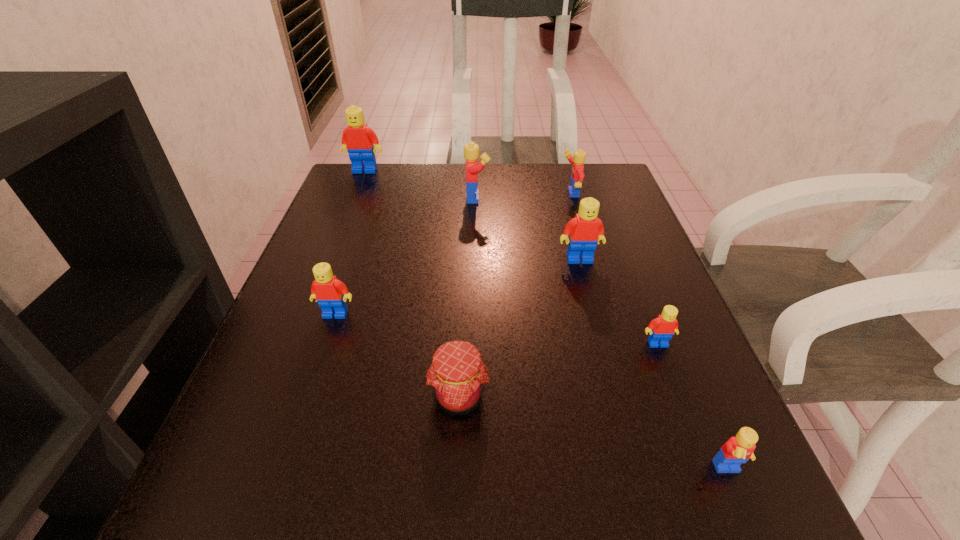
The width and height of the screenshot is (960, 540). In order to click on free space at the right edge of the desktop in this screenshot , I will do `click(656, 362)`.

You are a GUI agent. You are given a task and a screenshot of the screen. Output one action in this format:
    pyautogui.click(x=<x>, y=<y>)
    Task: Click on the vacant region at the near left corner of the desktop
    The width and height of the screenshot is (960, 540).
    Given the screenshot: What is the action you would take?
    pyautogui.click(x=319, y=476)

You are a GUI agent. You are given a task and a screenshot of the screen. Output one action in this format:
    pyautogui.click(x=<x>, y=<y>)
    Task: Click on the free space at the far right corner
    
    Given the screenshot: What is the action you would take?
    pyautogui.click(x=602, y=173)

In the image, there is a desktop. Where is `vacant space at the near right corner`? Image resolution: width=960 pixels, height=540 pixels. vacant space at the near right corner is located at coordinates (645, 478).

You are a GUI agent. You are given a task and a screenshot of the screen. Output one action in this format:
    pyautogui.click(x=<x>, y=<y>)
    Task: Click on the unoccupied area between the farthest red Lego and the rightmost yellow Lego
    
    Given the screenshot: What is the action you would take?
    pyautogui.click(x=547, y=321)

Image resolution: width=960 pixels, height=540 pixels. I want to click on free spot between the farthest Lego and the nearest yellow Lego, so click(x=547, y=321).

Identify the location of free space between the smallest red Lego and the tallest object. This screenshot has height=540, width=960. (512, 257).

The image size is (960, 540). In order to click on vacant area that lies between the fourth nearest object and the second yellow Lego from left to right in this screenshot , I will do `click(453, 254)`.

Where is `empty space between the second smallest yellow Lego and the second nearest Lego`? empty space between the second smallest yellow Lego and the second nearest Lego is located at coordinates (613, 269).

The width and height of the screenshot is (960, 540). What are the coordinates of `free area in between the jam and the biggest yellow Lego` in the screenshot? It's located at (468, 298).